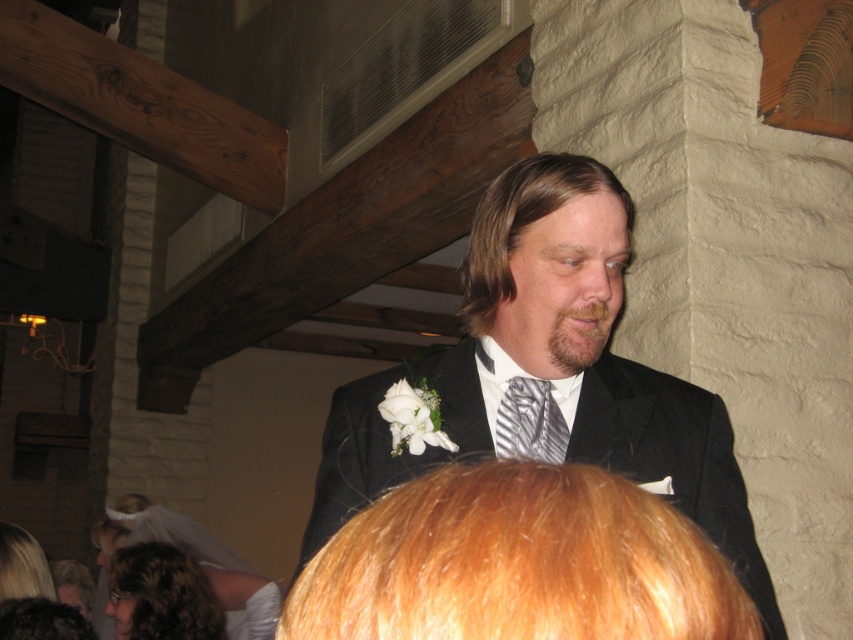
Question: Is black satin suit at center below silver striped tie at center?

Choices:
 (A) no
 (B) yes

Answer: (A)

Question: Among these points, which one is farthest from the camera?

Choices:
 (A) pos(514,442)
 (B) pos(471,326)
 (C) pos(393,480)

Answer: (B)

Question: Which object is closer to the camera taking this photo?

Choices:
 (A) blonde silky hair at center
 (B) dark brown hair at lower left

Answer: (A)

Question: Based on their relative distances, which object is farther from the dark brown hair at lower left?

Choices:
 (A) blonde silky hair at lower left
 (B) blonde silky hair at center
 (C) brownsmoothhair at center
 (D) silver striped tie at center

Answer: (B)

Question: Can you confirm if blonde silky hair at center is positioned above curly brown hair at lower left?

Choices:
 (A) no
 (B) yes

Answer: (B)

Question: Is silver striped tie at center wider than dark brown hair at lower left?

Choices:
 (A) no
 (B) yes

Answer: (A)